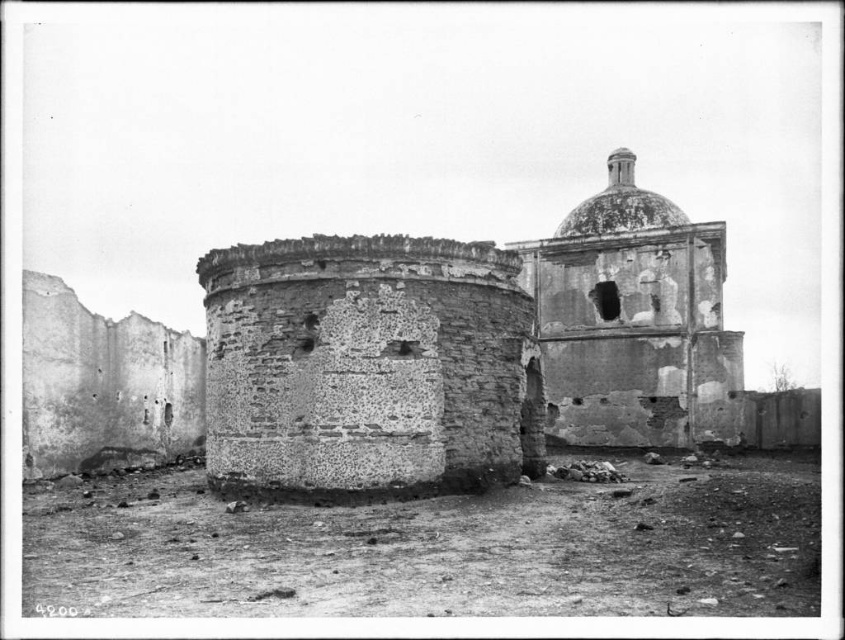
Based on the coordinates provided, which object corresponds to the point at (633, 321)?

The rough stone dome at upper right corresponds to the point at (633, 321).

You are an archaeologist examining the ruins. You notice the rough stone wall at center. Can you determine its exact 2D coordinates in the image?

The rough stone wall at center is located at the 2D coordinates of point (368,365).

You are a photographer standing at the camera position in front of the rough stone wall at center. You want to take a closeup shot of the wall. Do you think you can move closer than 40 meters to get a better shot?

The rough stone wall at center is 46.74 meters away from the camera. Since you want to move closer than 40 meters, you can move forward 6.74 meters to reach the desired distance.